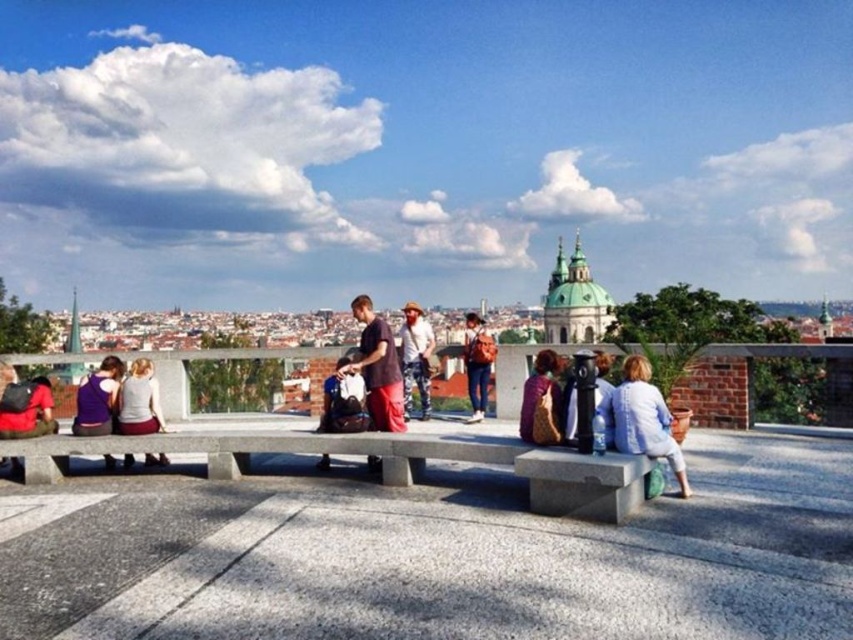
Consider the image. Can you confirm if light blue denim jacket at lower right is positioned above denim jacket at center?

No, light blue denim jacket at lower right is not above denim jacket at center.

Who is more distant from viewer, (x=664, y=435) or (x=404, y=376)?

The point (x=404, y=376) is behind.

Who is more forward, (663,410) or (424,381)?

Point (663,410) is more forward.

In order to click on light blue denim jacket at lower right in this screenshot , I will do [x=645, y=419].

Who is shorter, gray concrete bench at center or leather backpack at center?

gray concrete bench at center is shorter.

Does point (646, 468) come closer to viewer compared to point (538, 433)?

Yes, point (646, 468) is closer to viewer.

Identify the location of gray concrete bench at center. The height and width of the screenshot is (640, 853). (381, 461).

Between point (538, 385) and point (612, 435), which one is positioned behind?

Point (538, 385)

Which is more to the left, leather backpack at center or metallic black telescope at center?

From the viewer's perspective, leather backpack at center appears more on the left side.

Locate an element on the screen. leather backpack at center is located at coordinates (541, 401).

Image resolution: width=853 pixels, height=640 pixels. Identify the location of leather backpack at center. (541, 401).